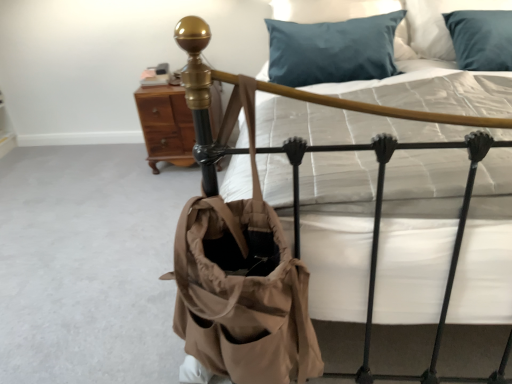
What are the coordinates of `vacant space situated on the left part of brown wood nightstand at upper left` in the screenshot? It's located at (121, 168).